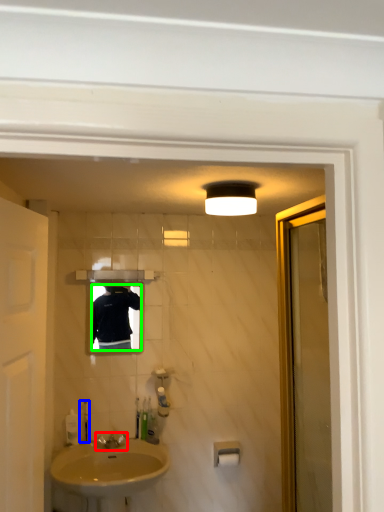
Question: Which object is the farthest from tap (highlighted by a red box)? Choose among these: soap dispenser (highlighted by a blue box) or mirror (highlighted by a green box).

Choices:
 (A) soap dispenser
 (B) mirror

Answer: (B)